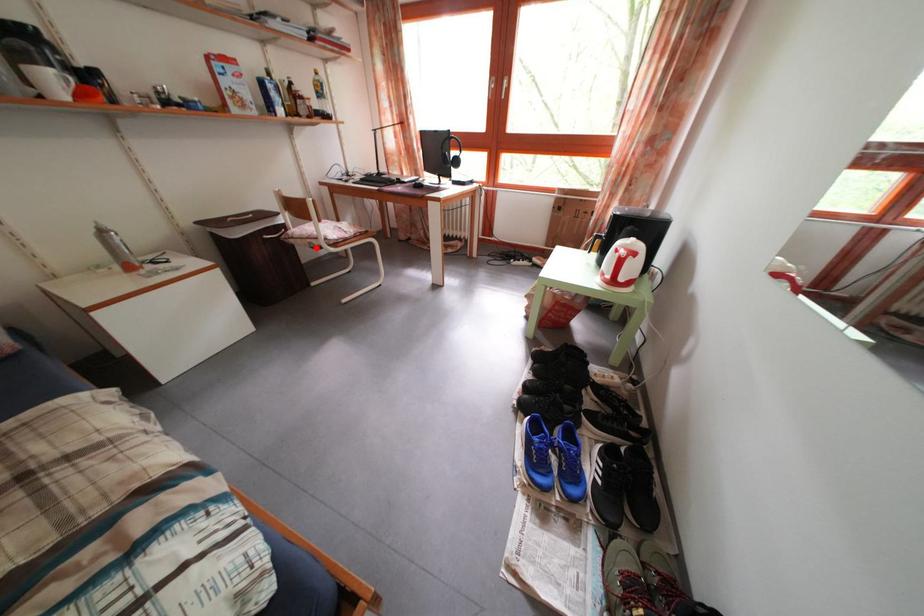
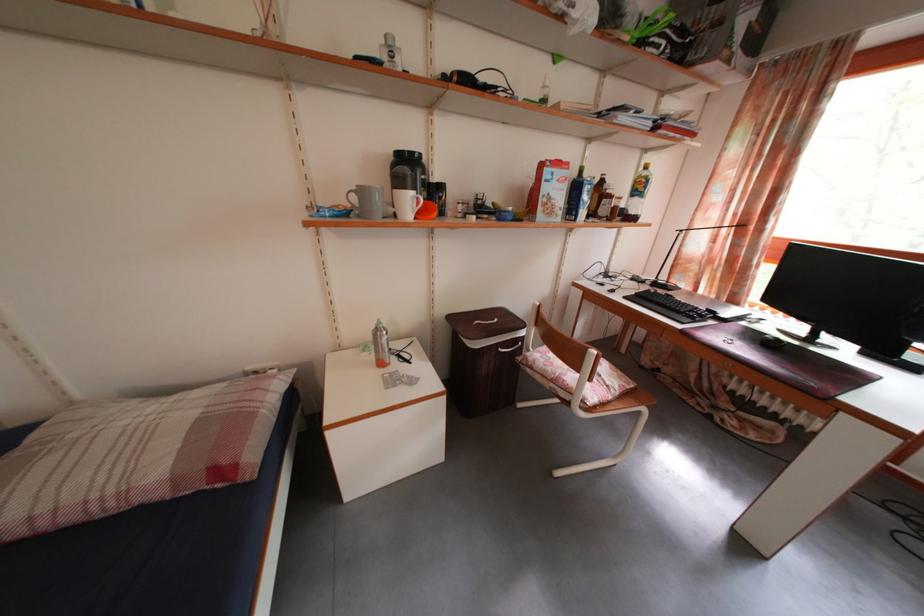
Question: I am providing you with two images of the same scene from different viewpoints. A red point is shown in image1. For the corresponding object point in image2, is it positioned nearer or farther from the camera?

Choices:
 (A) Nearer
 (B) Farther

Answer: (B)